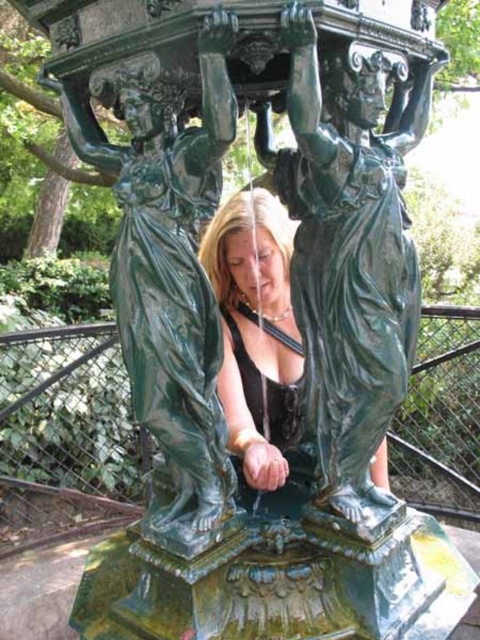
You are standing in front of a fountain with two statues. You see the green polished statue at center and the shiny green statue at center. Which one is nearer to you?

The green polished statue at center is closer to the viewer than the shiny green statue at center.

What is the object located at the coordinates point (348, 253) in the image?

The point (348, 253) corresponds to the green polished statue at center.